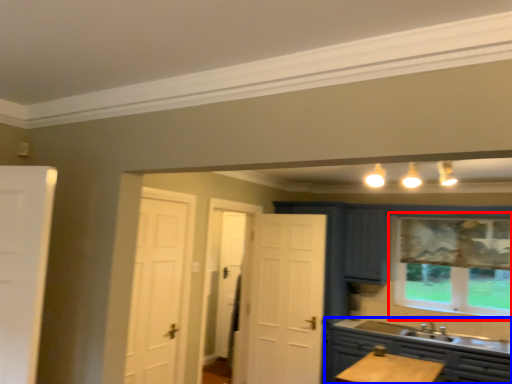
Question: Which object is closer to the camera taking this photo, window (highlighted by a red box) or cabinetry (highlighted by a blue box)?

Choices:
 (A) window
 (B) cabinetry

Answer: (B)